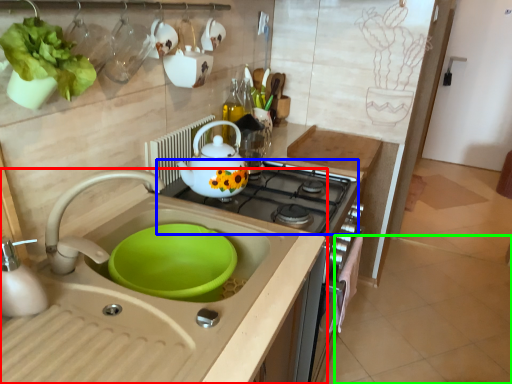
Question: Which object is positioned farthest from sink (highlighted by a red box)? Select from gas stove (highlighted by a blue box) and tile (highlighted by a green box).

Choices:
 (A) gas stove
 (B) tile

Answer: (B)